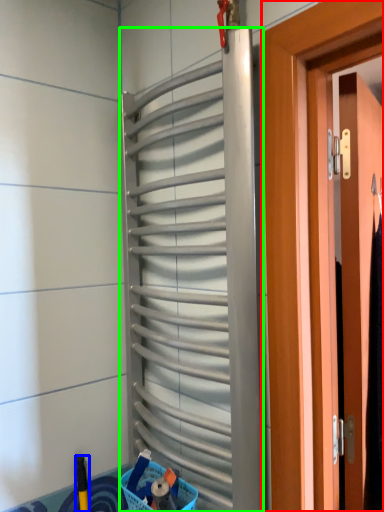
Question: Estimate the real-world distances between objects in this image. Which object is farther from door (highlighted by a red box), brush (highlighted by a blue box) or shutter (highlighted by a green box)?

Choices:
 (A) brush
 (B) shutter

Answer: (A)